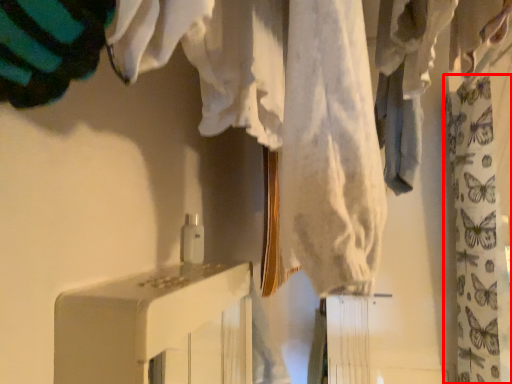
Question: From the image, what is the correct spatial relationship of curtain (annotated by the red box) in relation to furniture?

Choices:
 (A) right
 (B) left

Answer: (A)